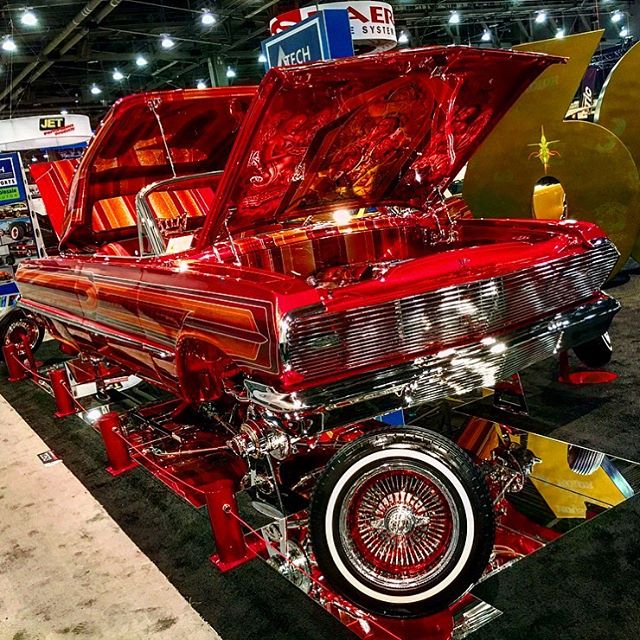
Locate an element on the screen. Image resolution: width=640 pixels, height=640 pixels. mirror is located at coordinates (554, 473), (536, 504), (504, 548), (395, 624), (189, 467), (88, 397), (75, 369).